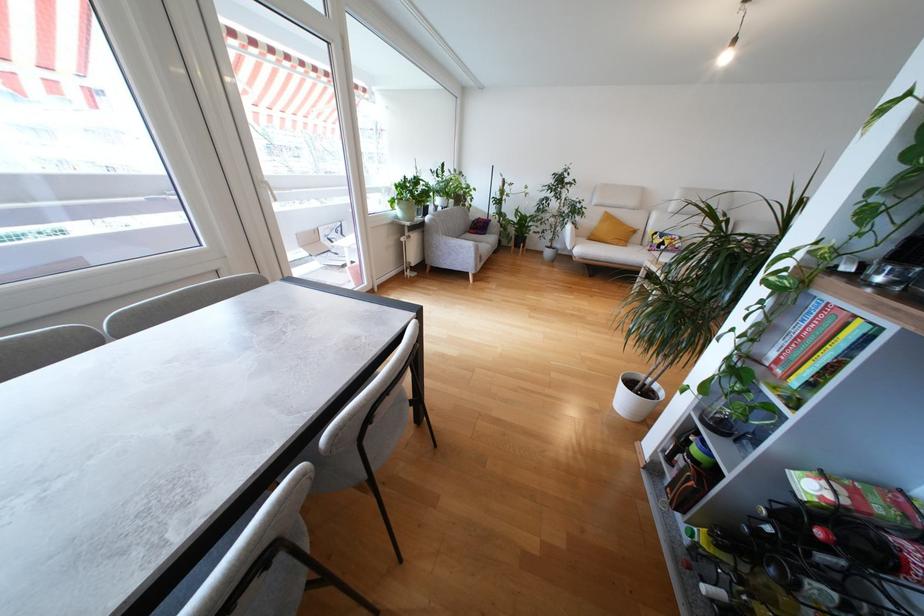
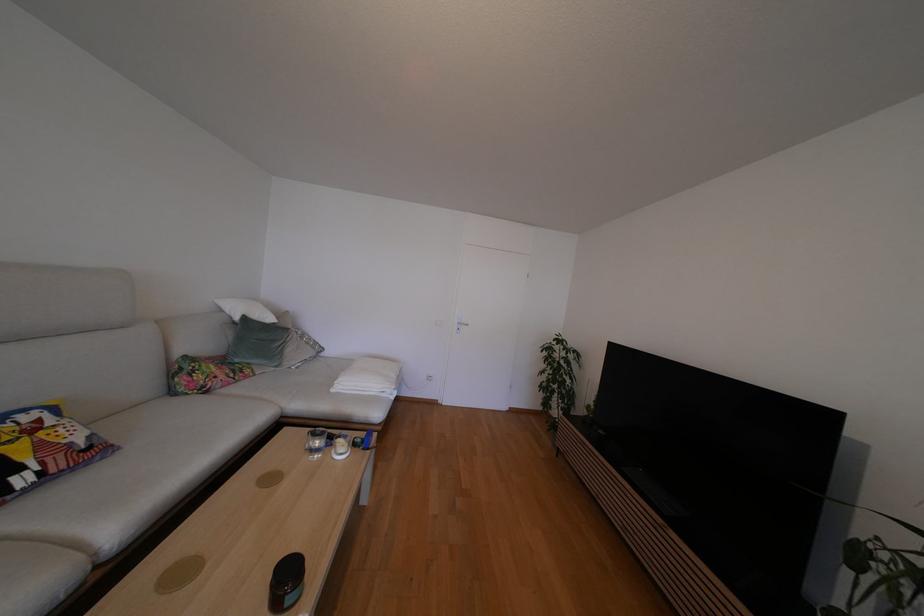
Locate, in the second image, the point that corresponds to point (675, 245) in the first image.

(44, 448)